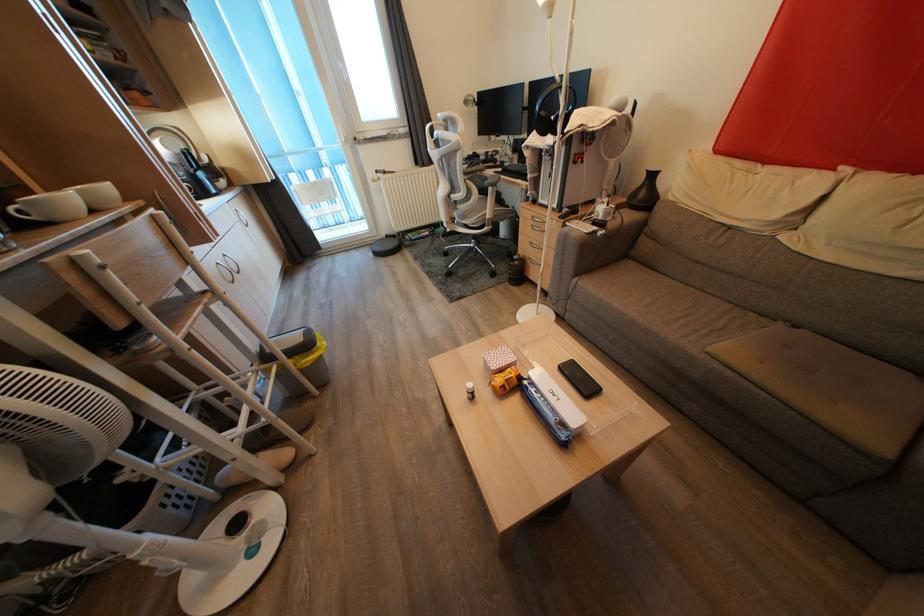
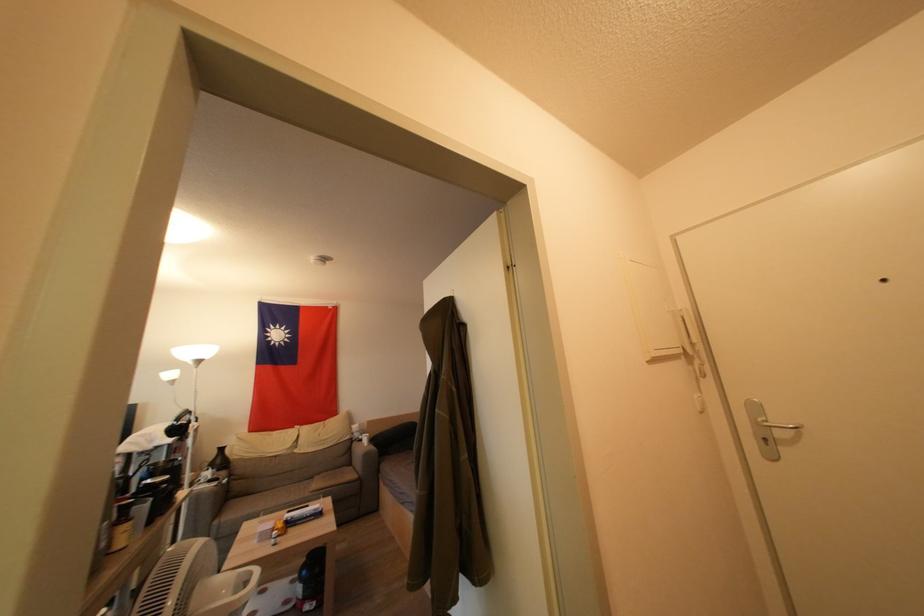
In the second image, find the point that corresponds to point 647,199 in the first image.

(224, 464)